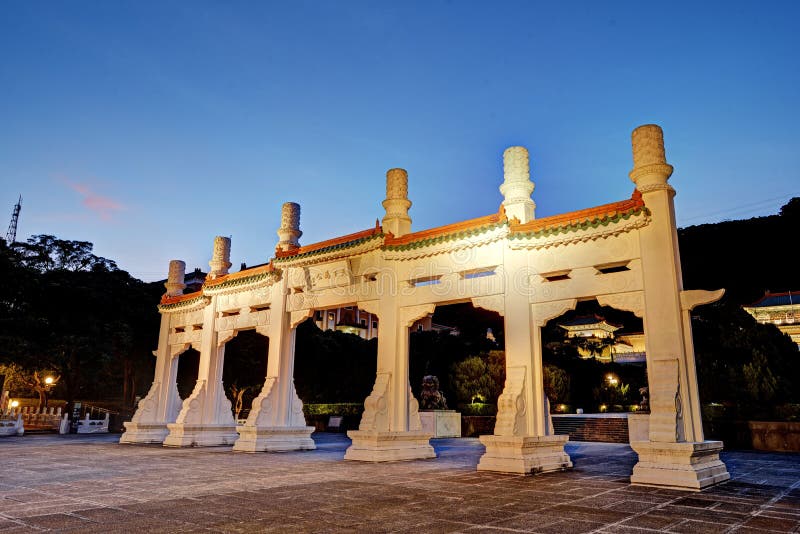
Image resolution: width=800 pixels, height=534 pixels. Find the location of `scuplture`. scuplture is located at coordinates (430, 388).